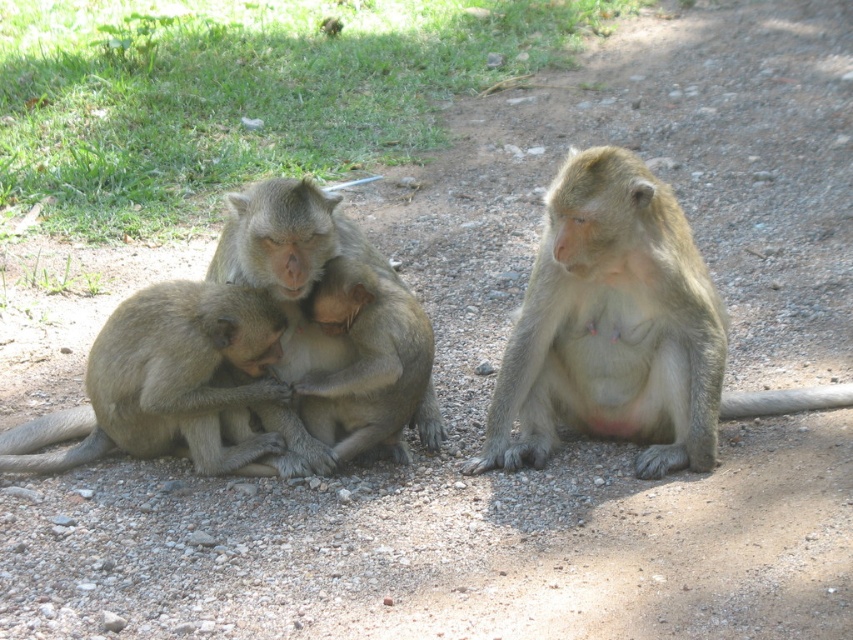
Does light brown fur monkey at center have a smaller size compared to light brown fur monkey at center left?

Actually, light brown fur monkey at center might be larger than light brown fur monkey at center left.

Where is `light brown fur monkey at center`? light brown fur monkey at center is located at coordinates (619, 330).

Between point (660, 460) and point (96, 438), which one is positioned behind?

The point (96, 438) is more distant.

Where is `light brown fur monkey at center`? The image size is (853, 640). light brown fur monkey at center is located at coordinates (619, 330).

Is point (160, 412) less distant than point (276, 186)?

No, (160, 412) is behind (276, 186).

Can you confirm if light brown fur monkey at center left is shorter than brown fur monkey at center?

Incorrect, light brown fur monkey at center left's height does not fall short of brown fur monkey at center's.

Which is behind, point (256, 349) or point (223, 228)?

The point (223, 228) is behind.

Find the location of a particular element. This screenshot has width=853, height=640. light brown fur monkey at center left is located at coordinates (164, 381).

Is light brown fur monkey at center to the right of brown fur monkey at center from the viewer's perspective?

Indeed, light brown fur monkey at center is positioned on the right side of brown fur monkey at center.

Who is more distant from viewer, (683,456) or (297,193)?

Positioned behind is point (683,456).

Who is more forward, (558,419) or (215,248)?

Positioned in front is point (558,419).

Find the location of a particular element. light brown fur monkey at center is located at coordinates (619, 330).